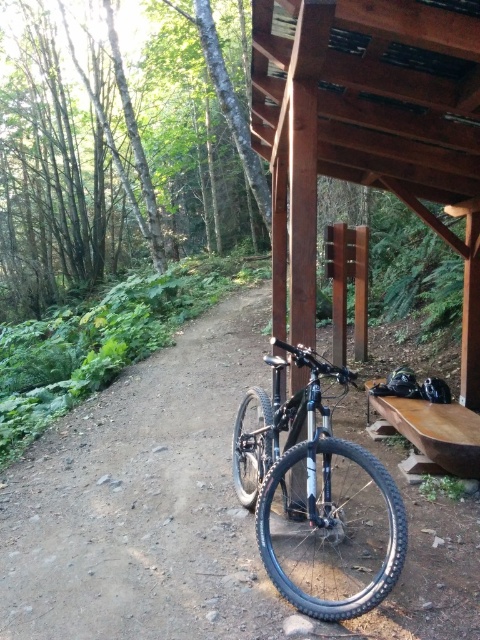
Question: Which object is the farthest from the brown wooden shelter at upper center?

Choices:
 (A) dirt path at center
 (B) shiny black mountain bike at center

Answer: (A)

Question: Which point is farther from the camera taking this photo?

Choices:
 (A) (276, 33)
 (B) (160, 525)
 (C) (343, 381)

Answer: (A)

Question: Is dirt path at center thinner than shiny black mountain bike at center?

Choices:
 (A) no
 (B) yes

Answer: (B)

Question: Which object appears farthest from the camera in this image?

Choices:
 (A) dirt path at center
 (B) shiny black mountain bike at center

Answer: (A)

Question: Considering the relative positions of brown wooden shelter at upper center and shiny black mountain bike at center in the image provided, where is brown wooden shelter at upper center located with respect to shiny black mountain bike at center?

Choices:
 (A) right
 (B) left

Answer: (A)

Question: Where is dirt path at center located in relation to brown wooden shelter at upper center in the image?

Choices:
 (A) left
 (B) right

Answer: (A)